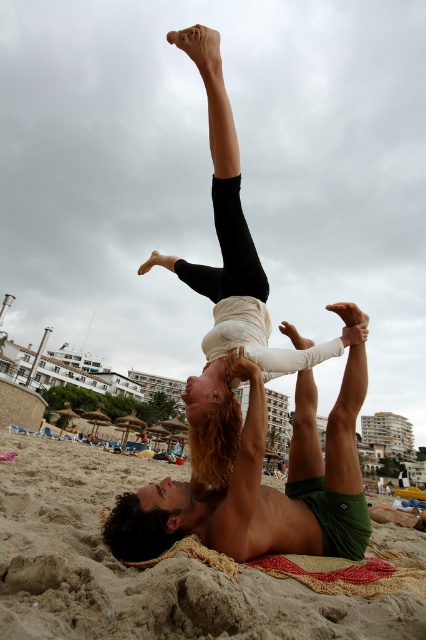
Does white cotton shirt at center appear under sandy beach at lower center?

No.

Can you confirm if white cotton shirt at center is positioned to the right of sandy beach at lower center?

Yes, white cotton shirt at center is to the right of sandy beach at lower center.

You are a GUI agent. You are given a task and a screenshot of the screen. Output one action in this format:
    pyautogui.click(x=<x>, y=<y>)
    Task: Click on the white cotton shirt at center
    The image size is (426, 640).
    Given the screenshot: What is the action you would take?
    pyautogui.click(x=249, y=400)

Who is higher up, white cotton shirt at center or green shorts at center?

white cotton shirt at center is higher up.

Is point (218, 44) closer to viewer compared to point (304, 371)?

Yes, it is.

Between point (212, 371) and point (253, 525), which one is positioned in front?

Point (253, 525)

Find the location of a particular element. white cotton shirt at center is located at coordinates [x=249, y=400].

Is sandy beach at lower center below green shorts at center?

Yes, sandy beach at lower center is below green shorts at center.

Can you confirm if sandy beach at lower center is positioned to the left of green shorts at center?

Yes, sandy beach at lower center is to the left of green shorts at center.

Which is behind, point (92, 534) or point (155, 486)?

Positioned behind is point (155, 486).

Find the location of `sandy beach at lower center`. sandy beach at lower center is located at coordinates (143, 570).